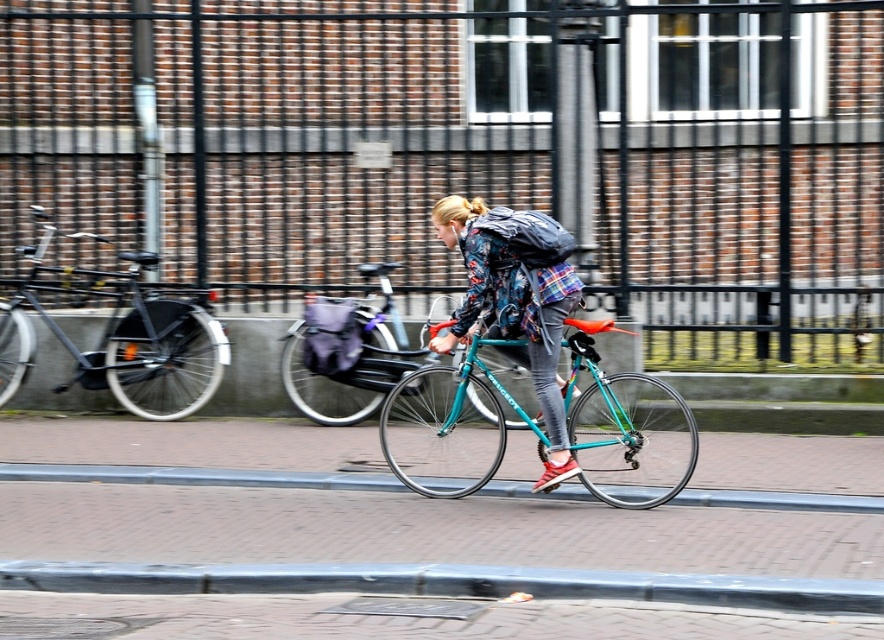
You are a delivery person who needs to park your teal metallic bicycle at center near the brick at lower center. Considering the space between them, can your bicycle fit in the available space?

The distance between the teal metallic bicycle at center and brick at lower center is 3.98 feet. Since the bicycle is likely shorter than this distance, it should fit comfortably in the available space.

Consider the image. You are a photographer trying to capture the cyclist in motion. You notice two points in the scene at coordinates point (652, 480) and point (801, 508). Which point is closer to your camera lens?

Point (652, 480) is closer to the camera lens than point (801, 508) because it is further to the viewer.